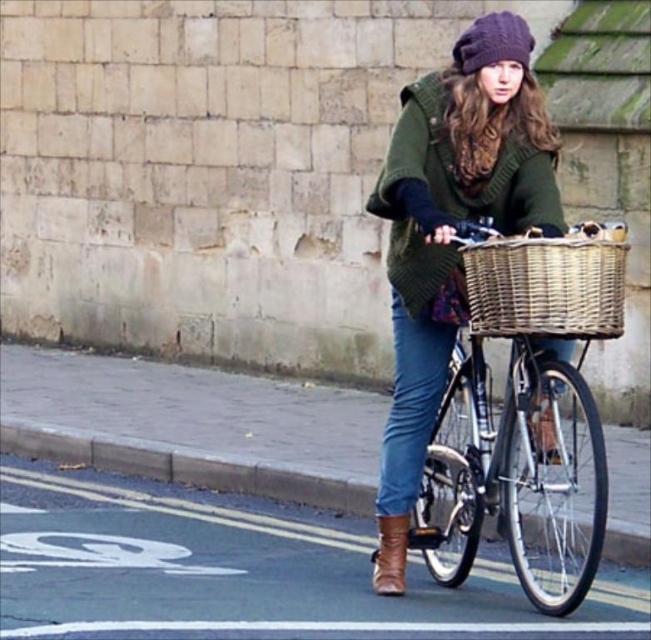
Is point (508, 276) behind point (393, 545)?

That is False.

Can you confirm if woven wicker basket at center is wider than brown suede boot at lower center?

Yes.

Find the location of a particular element. woven wicker basket at center is located at coordinates (544, 284).

Can you confirm if matte wicker basket at center is smaller than brown suede boot at lower center?

No.

Measure the distance between matte wicker basket at center and camera.

matte wicker basket at center and camera are 22.43 feet apart.

Where is `matte wicker basket at center`? This screenshot has height=640, width=651. matte wicker basket at center is located at coordinates (523, 417).

Is point (542, 512) positioned after point (467, 48)?

That is True.

Which is more to the right, matte wicker basket at center or knitted purple hat at upper center?

Positioned to the right is matte wicker basket at center.

Identify the location of matte wicker basket at center. This screenshot has height=640, width=651. (523, 417).